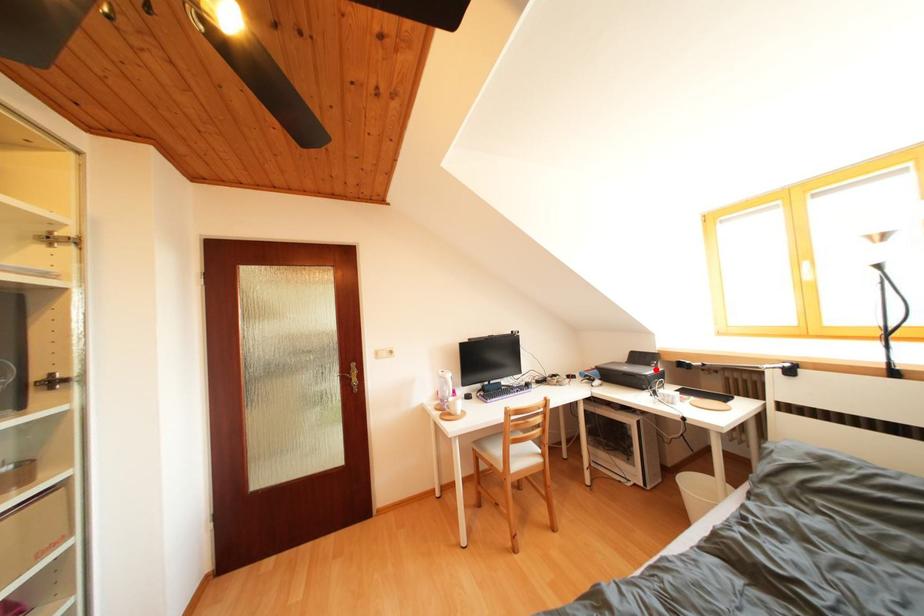
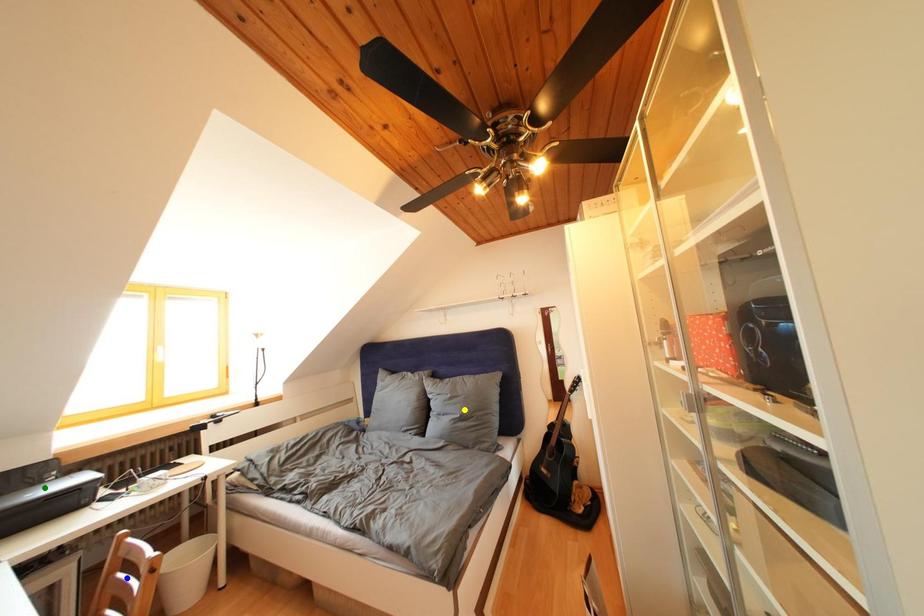
Question: I am providing you with two images of the same scene from different viewpoints. A red point is marked on the first image. You are given multiple points on the second image. Can you choose the point in image 2 that corresponds to the point in image 1?

Choices:
 (A) green point
 (B) blue point
 (C) yellow point

Answer: (A)